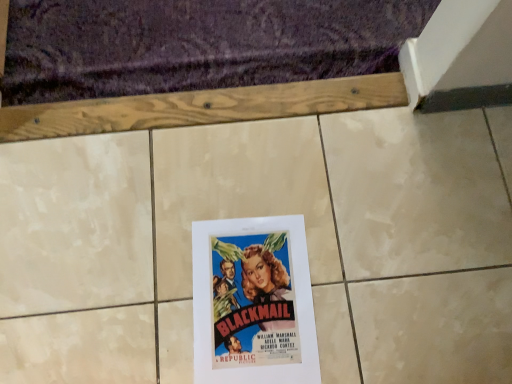
Describe the element at coordinates (253, 302) in the screenshot. I see `matte paper poster at center` at that location.

Find the location of a particular element. matte paper poster at center is located at coordinates (253, 302).

The height and width of the screenshot is (384, 512). I want to click on matte paper poster at center, so click(253, 302).